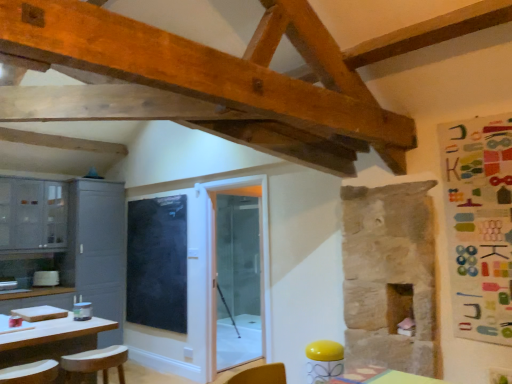
Question: From their relative heights in the image, would you say matte gray cabinet at left, the second cabinetry in the left-to-right sequence, is taller or shorter than matte gray cabinets at left, placed as the 2th cabinetry when sorted from right to left?

Choices:
 (A) tall
 (B) short

Answer: (A)

Question: Is matte gray cabinet at left, acting as the 1th cabinetry starting from the right, inside the boundaries of matte gray cabinets at left, placed as the 2th cabinetry when sorted from right to left, or outside?

Choices:
 (A) outside
 (B) inside

Answer: (A)

Question: Estimate the real-world distances between objects in this image. Which object is closer to the yellow glossy bar stool at lower right?

Choices:
 (A) matte gray cabinets at left, placed as the 2th cabinetry when sorted from right to left
 (B) black matte chalkboard at center
 (C) transparent glass door at center
 (D) wooden stool at lower left
 (E) matte gray cabinet at left, acting as the 1th cabinetry starting from the right

Answer: (D)

Question: Which of these objects is positioned closest to the black matte chalkboard at center?

Choices:
 (A) colorful fabric bulletin board at right
 (B) matte gray cabinet at left, acting as the 1th cabinetry starting from the right
 (C) yellow glossy bar stool at lower right
 (D) wooden stool at lower left
 (E) transparent glass door at center

Answer: (B)